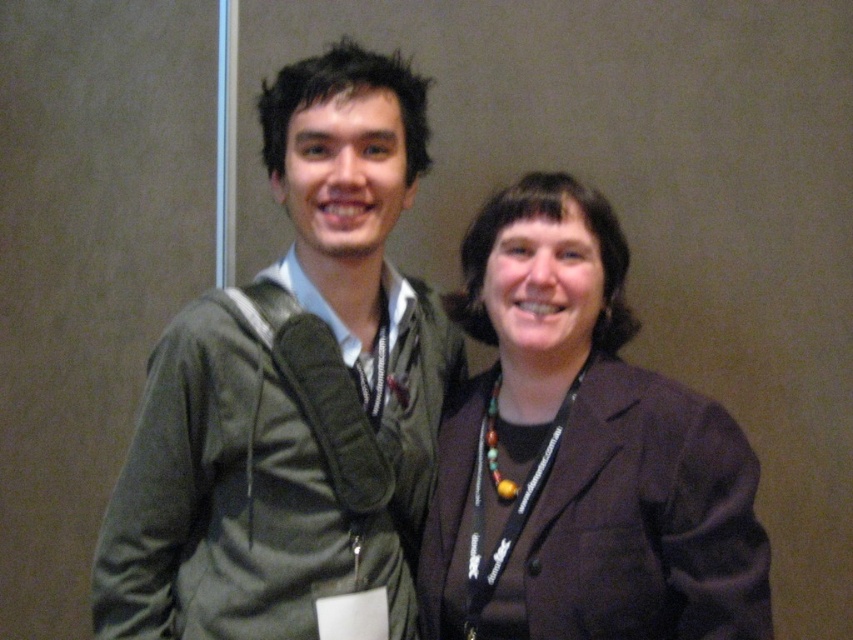
You are an event organizer and need to separate two attendees whose jackets are too close to each other. The jackets are the green fabric jacket at left and the brown fabric jacket at center. Which jacket should you move to the right to create space between them?

The green fabric jacket at left is to the left of brown fabric jacket at center. To create space between them, you should move the brown fabric jacket at center to the right.